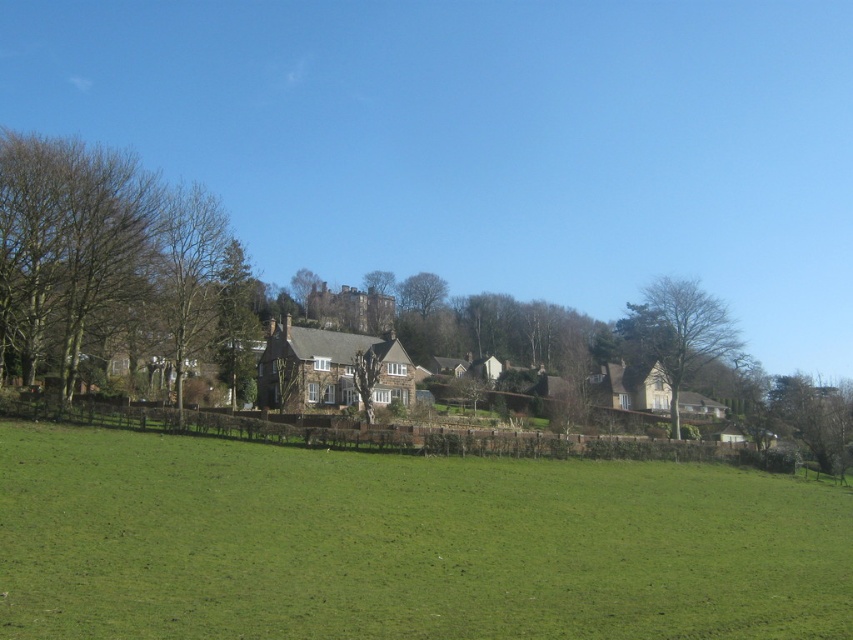
Question: Among these points, which one is farthest from the camera?

Choices:
 (A) (244, 374)
 (B) (796, 387)
 (C) (12, 486)
 (D) (91, 161)

Answer: (B)

Question: Can you confirm if green grass at center is bigger than bare wood tree at right?

Choices:
 (A) yes
 (B) no

Answer: (B)

Question: Is bare wood tree at right thinner than green leafy tree at lower right?

Choices:
 (A) no
 (B) yes

Answer: (A)

Question: Considering the relative positions of green grass at center and green leafy tree at lower right in the image provided, where is green grass at center located with respect to green leafy tree at lower right?

Choices:
 (A) right
 (B) left

Answer: (B)

Question: Which point is closer to the camera?

Choices:
 (A) green grass at center
 (B) brown leafless tree at left
 (C) green leafy tree at lower right

Answer: (A)

Question: Which point is farther to the camera?

Choices:
 (A) green grass at center
 (B) brown leafless tree at left
 (C) green leafy tree at lower right
 (D) green leafy tree at center

Answer: (D)